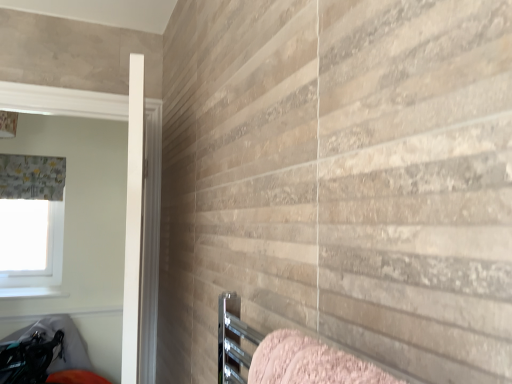
Question: Can you confirm if white glossy window sill at lower left is positioned to the left of pink textured towel at lower right?

Choices:
 (A) yes
 (B) no

Answer: (A)

Question: Is white glossy window sill at lower left further to camera compared to pink textured towel at lower right?

Choices:
 (A) no
 (B) yes

Answer: (B)

Question: Is pink textured towel at lower right at the back of white glossy window sill at lower left?

Choices:
 (A) yes
 (B) no

Answer: (B)

Question: Is white glossy window sill at lower left at the right side of pink textured towel at lower right?

Choices:
 (A) yes
 (B) no

Answer: (B)

Question: From the image's perspective, is white glossy window sill at lower left above pink textured towel at lower right?

Choices:
 (A) yes
 (B) no

Answer: (B)

Question: Can you confirm if white glossy window sill at lower left is taller than pink textured towel at lower right?

Choices:
 (A) yes
 (B) no

Answer: (B)

Question: Does white fabric at upper left have a smaller size compared to textured gray curtain at left?

Choices:
 (A) no
 (B) yes

Answer: (B)

Question: Is white fabric at upper left outside of textured gray curtain at left?

Choices:
 (A) yes
 (B) no

Answer: (A)

Question: Is white fabric at upper left bigger than textured gray curtain at left?

Choices:
 (A) no
 (B) yes

Answer: (A)

Question: Is the surface of white fabric at upper left in direct contact with textured gray curtain at left?

Choices:
 (A) no
 (B) yes

Answer: (A)

Question: Can you confirm if white fabric at upper left is taller than textured gray curtain at left?

Choices:
 (A) no
 (B) yes

Answer: (B)

Question: From the image's perspective, is white fabric at upper left located beneath textured gray curtain at left?

Choices:
 (A) no
 (B) yes

Answer: (B)

Question: Is pink textured towel at lower right next to white glossy window sill at lower left?

Choices:
 (A) yes
 (B) no

Answer: (B)